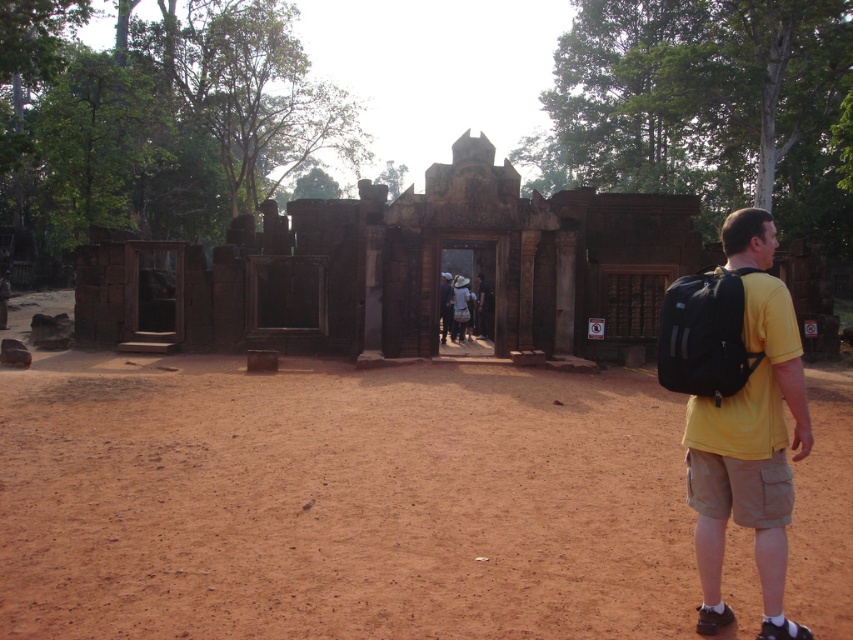
You are standing in front of the ancient stone structure and notice two points marked on the ground. One is at coordinate point [241,406] and the other at point [308,340]. Which point is nearer to you?

Point [241,406] is closer to the viewer than point [308,340].

You are a hiker who wants to reach the brown stone ruins at center. You are currently standing on the brown sandy dirt track at center. Which direction should you move to get to the ruins?

The brown sandy dirt track at center is to the left of the brown stone ruins at center, so you should move to the right to reach the ruins.

You are a hiker planning to walk from the brown sandy dirt track at center to the yellow cotton shirt at right. Based on the scene description, which object is closer to you?

The brown sandy dirt track at center is closer to you since it is shorter in distance compared to the yellow cotton shirt at right.